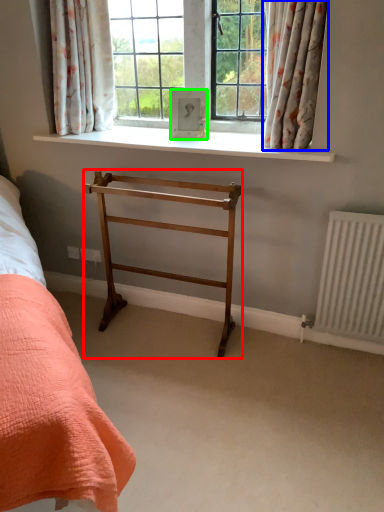
Question: Estimate the real-world distances between objects in this image. Which object is farther from furniture (highlighted by a red box), curtain (highlighted by a blue box) or picture frame (highlighted by a green box)?

Choices:
 (A) curtain
 (B) picture frame

Answer: (A)